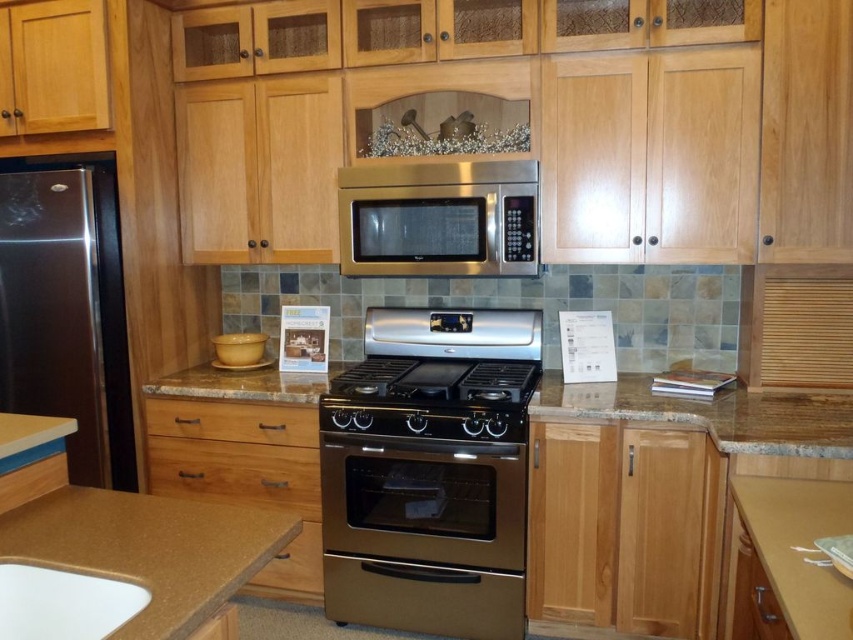
Question: Is white glossy sink at lower left smaller than stainless steel gas stove at center?

Choices:
 (A) no
 (B) yes

Answer: (B)

Question: Does stainless steel oven at center appear on the left side of satin stainless steel refrigerator at left?

Choices:
 (A) yes
 (B) no

Answer: (B)

Question: Which of the following is the closest to the observer?

Choices:
 (A) stainless steel oven at center
 (B) brown granite countertop at center
 (C) stainless steel microwave at center
 (D) satin stainless steel exhaust hood at center

Answer: (B)

Question: Which point is farther from the camera taking this photo?

Choices:
 (A) (482, 509)
 (B) (428, 330)
 (C) (479, 166)

Answer: (B)

Question: Which of these objects is positioned farthest from the brown granite countertop at center?

Choices:
 (A) white glossy sink at lower left
 (B) stainless steel gas stove at center
 (C) stainless steel microwave at center

Answer: (A)

Question: Is stainless steel oven at center to the right of satin stainless steel refrigerator at left from the viewer's perspective?

Choices:
 (A) no
 (B) yes

Answer: (B)